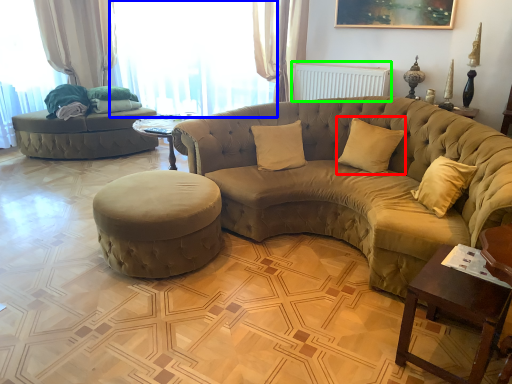
Question: Considering the real-world distances, which object is farthest from pillow (highlighted by a red box)? window (highlighted by a blue box) or radiator (highlighted by a green box)?

Choices:
 (A) window
 (B) radiator

Answer: (A)